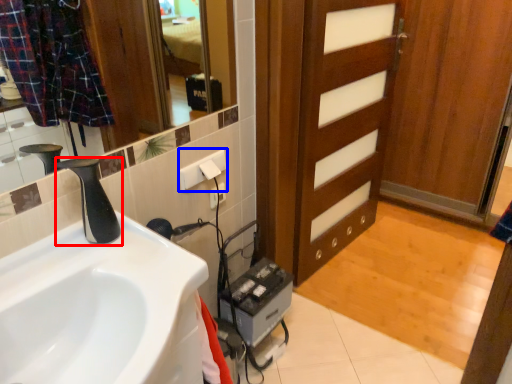
Question: Which object appears farthest to the camera in this image, tap (highlighted by a red box) or electric outlet (highlighted by a blue box)?

Choices:
 (A) tap
 (B) electric outlet

Answer: (B)